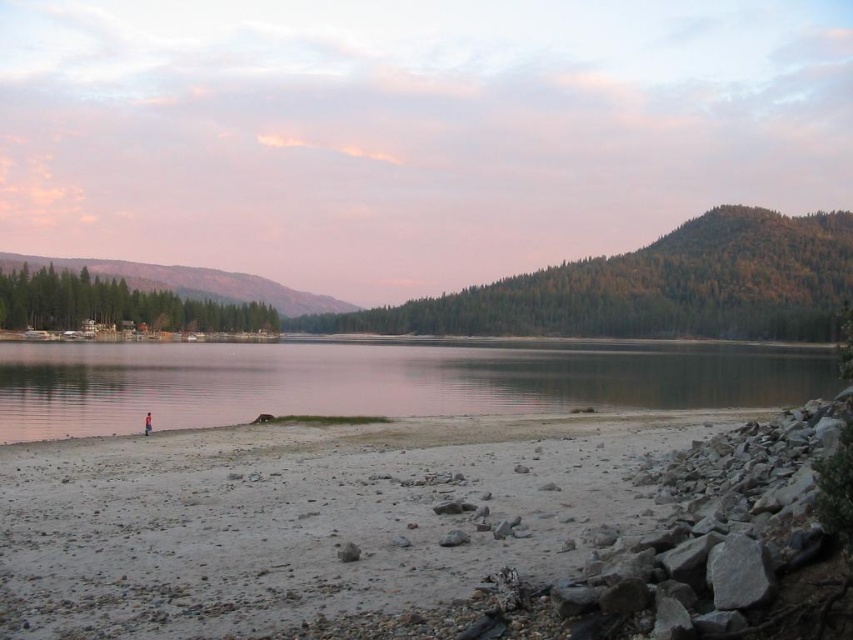
You are planning to set up a small tent for a lakeside camping trip. Given the scene, which location would be more suitable between the smooth sand beach at lower left and the green forested mountain at left, considering space availability?

The smooth sand beach at lower left has a smaller size compared to the green forested mountain at left, so the green forested mountain at left would provide more space for setting up a tent.

You are standing at the lakeside and want to take a photo of both the clear water at center and the green forested mountain at center. Which object should you focus on first to ensure both are in sharp focus?

You should focus on the green forested mountain at center first because it is farther away than the clear water at center, so adjusting focus from far to near can help ensure both are sharp.